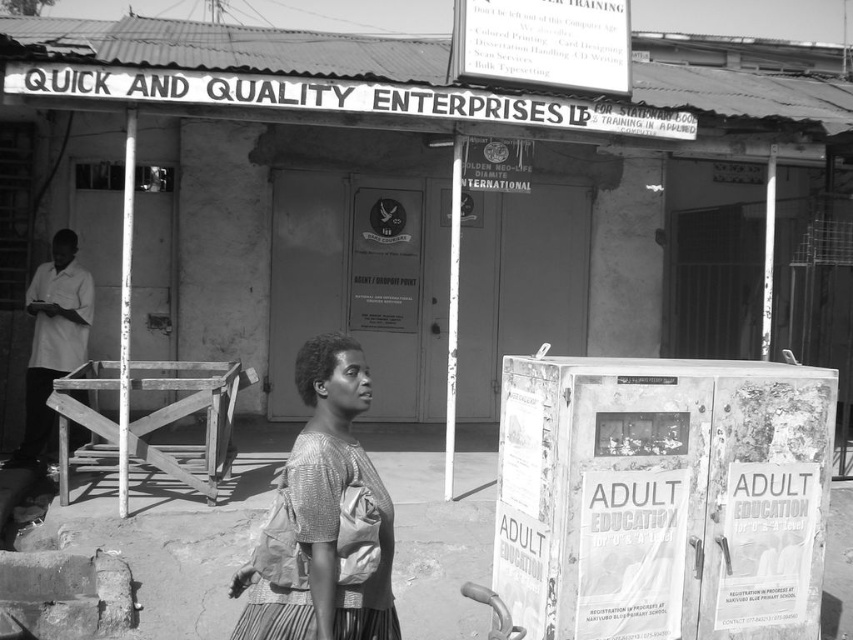
You are standing in the street scene and want to place a small potted plant between the white cardboard bulletin board at lower right and the knitted fabric dress at center. Can you do this without moving either object?

The white cardboard bulletin board at lower right is further to the viewer than the knitted fabric dress at center, so there is space between them to place the potted plant without moving either object.

You are a photographer standing at the center of the urban street scene. You want to take a photo of the knitted fabric dress at center while also including the wooden structure to the left of the woman in the frame. The minimum distance between the two objects to fit both in the photo is 3 meters. Can you capture both in a single shot?

The knitted fabric dress at center and the wooden structure to the left of the woman are 2.88 meters apart, which is less than the required 3 meters. Therefore, you can capture both in a single shot.

Based on the photo, you are a photographer trying to capture the scene. You notice the knitted fabric dress at center and the white shirt at left. Which clothing item is closer to the camera?

The knitted fabric dress at center is positioned under the white shirt at left, meaning the white shirt at left is closer to the camera.